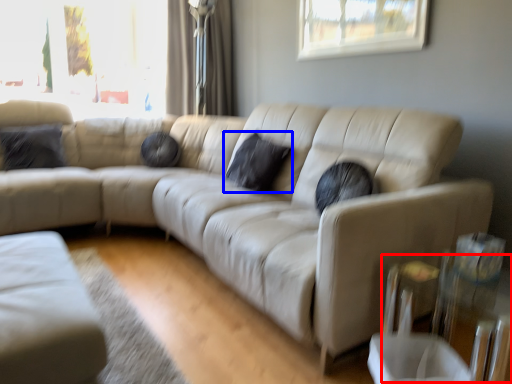
Question: Which of the following is the closest to the observer, glass table (highlighted by a red box) or pillow (highlighted by a blue box)?

Choices:
 (A) glass table
 (B) pillow

Answer: (A)